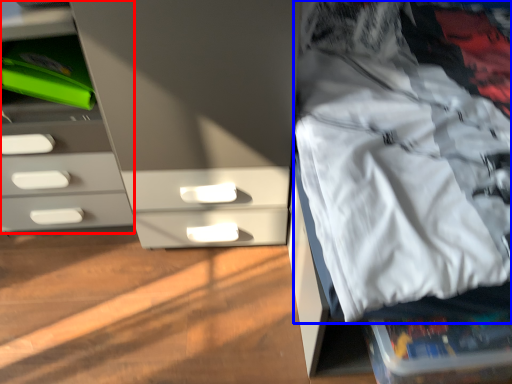
Question: Which object is closer to the camera taking this photo, chest of drawers (highlighted by a red box) or clothing (highlighted by a blue box)?

Choices:
 (A) chest of drawers
 (B) clothing

Answer: (B)